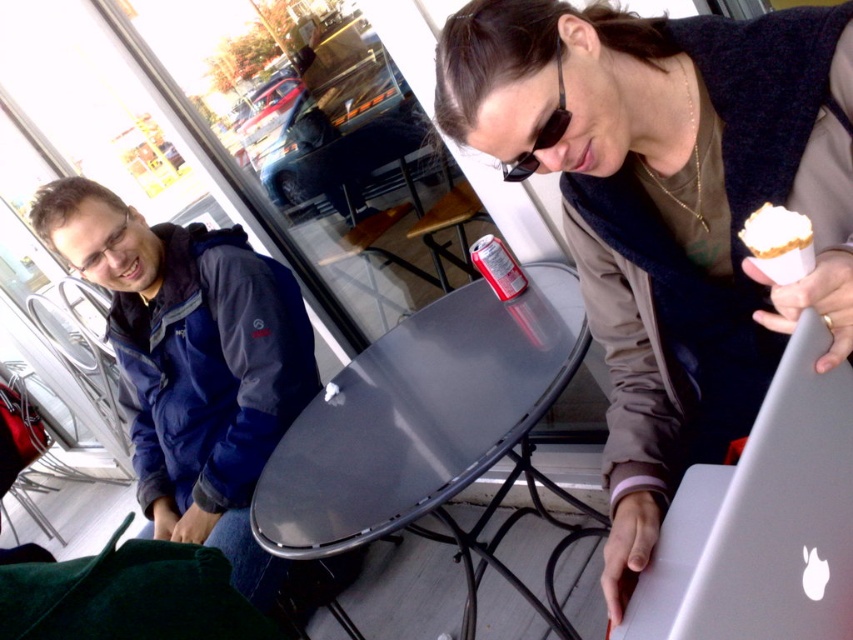
Measure the distance between silver metallic laptop at center and camera.

silver metallic laptop at center is 20.54 inches from camera.

Looking at this image, is silver metallic laptop at center positioned before white paper ice cream cone at upper right?

Yes.

Who is more distant from viewer, (706, 536) or (799, 248)?

Positioned behind is point (706, 536).

The width and height of the screenshot is (853, 640). Identify the location of silver metallic laptop at center. (762, 522).

Is the position of blue fabric jacket at left more distant than that of sunglasses at center?

Yes, it is.

Is blue fabric jacket at left positioned in front of sunglasses at center?

No, blue fabric jacket at left is behind sunglasses at center.

This screenshot has height=640, width=853. I want to click on blue fabric jacket at left, so click(198, 374).

From the picture: Is matte black jacket at center to the right of glossy metal table at center from the viewer's perspective?

Yes, matte black jacket at center is to the right of glossy metal table at center.

Can you confirm if matte black jacket at center is shorter than glossy metal table at center?

Incorrect, matte black jacket at center's height does not fall short of glossy metal table at center's.

The height and width of the screenshot is (640, 853). Describe the element at coordinates (671, 209) in the screenshot. I see `matte black jacket at center` at that location.

At what (x,y) coordinates should I click in order to perform the action: click on matte black jacket at center. Please return your answer as a coordinate pair (x, y). Looking at the image, I should click on tap(671, 209).